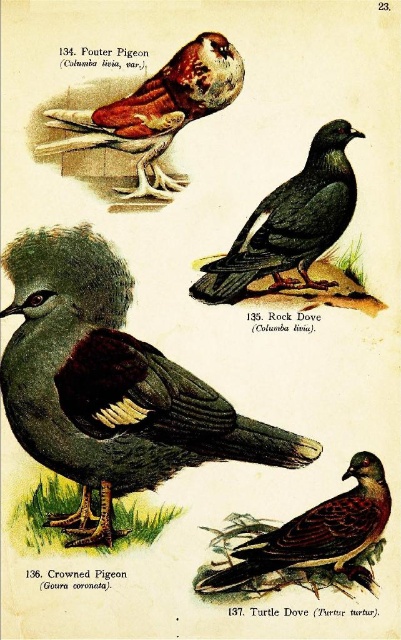
In the illustration of the Pouter Pigeon, there are two points labeled as point (74, 436) and point (388, 493). Which point is closer to the viewer?

Point (74, 436) is closer to the viewer as it is in front of point (388, 493).

Based on the photo, in the illustration, you see a matte brown feathers at upper left and a brown speckled feathered pigeon at lower right. Which one is located more to the left?

The matte brown feathers at upper left is more to the left than the brown speckled feathered pigeon at lower right.